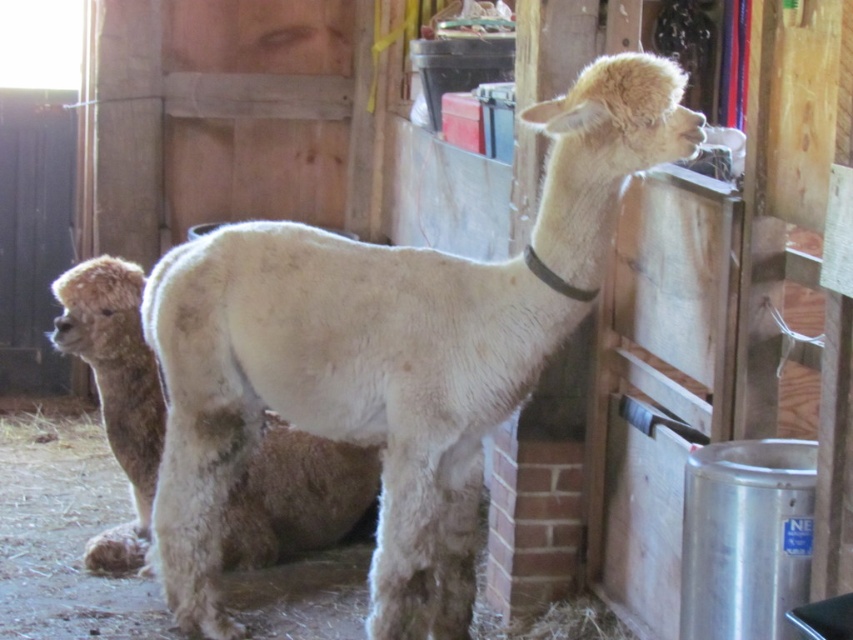
Is white woolen alpaca at center behind fuzzy white alpaca at center?

No, white woolen alpaca at center is closer to the viewer.

Between white woolen alpaca at center and fuzzy white alpaca at center, which one is positioned higher?

white woolen alpaca at center is above.

Identify the location of white woolen alpaca at center. The image size is (853, 640). tap(389, 353).

Where is `white woolen alpaca at center`? This screenshot has height=640, width=853. white woolen alpaca at center is located at coordinates (389, 353).